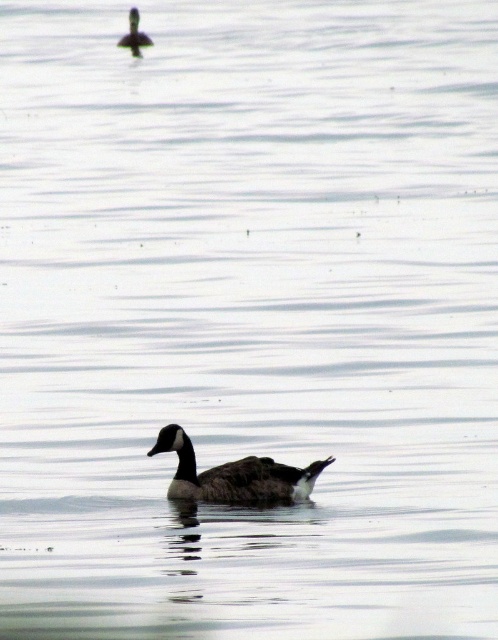
Question: Among these points, which one is farthest from the camera?

Choices:
 (A) click(x=218, y=488)
 (B) click(x=128, y=29)

Answer: (B)

Question: Which point is farther from the camera taking this photo?

Choices:
 (A) (132, 10)
 (B) (174, 451)

Answer: (A)

Question: Which point is closer to the camera?

Choices:
 (A) (127, 42)
 (B) (262, 476)

Answer: (B)

Question: Does dark brown feathered duck at center have a lesser width compared to dark brown feathers at upper center?

Choices:
 (A) yes
 (B) no

Answer: (B)

Question: Is dark brown feathered duck at center thinner than dark brown feathers at upper center?

Choices:
 (A) yes
 (B) no

Answer: (B)

Question: Can you confirm if dark brown feathered duck at center is positioned to the left of dark brown feathers at upper center?

Choices:
 (A) no
 (B) yes

Answer: (A)